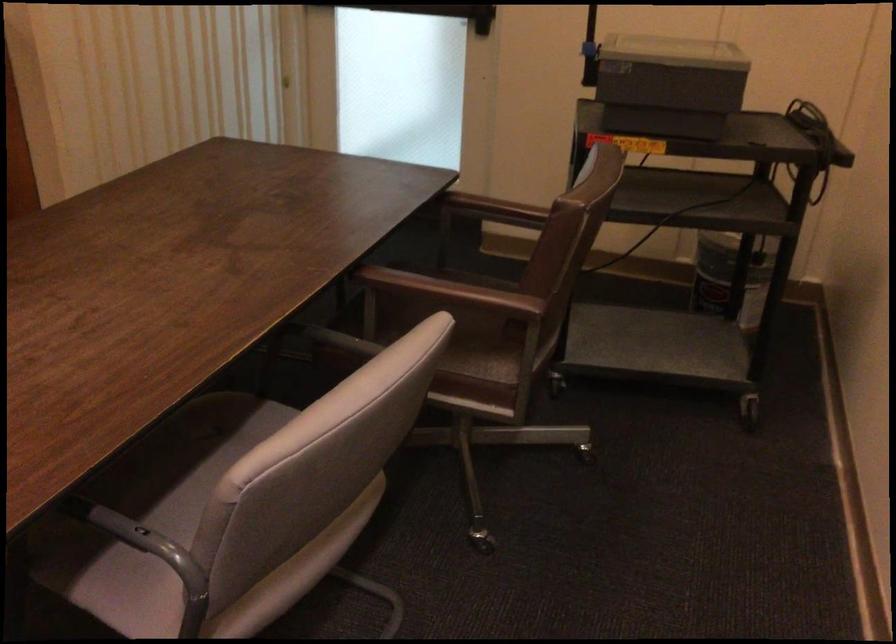
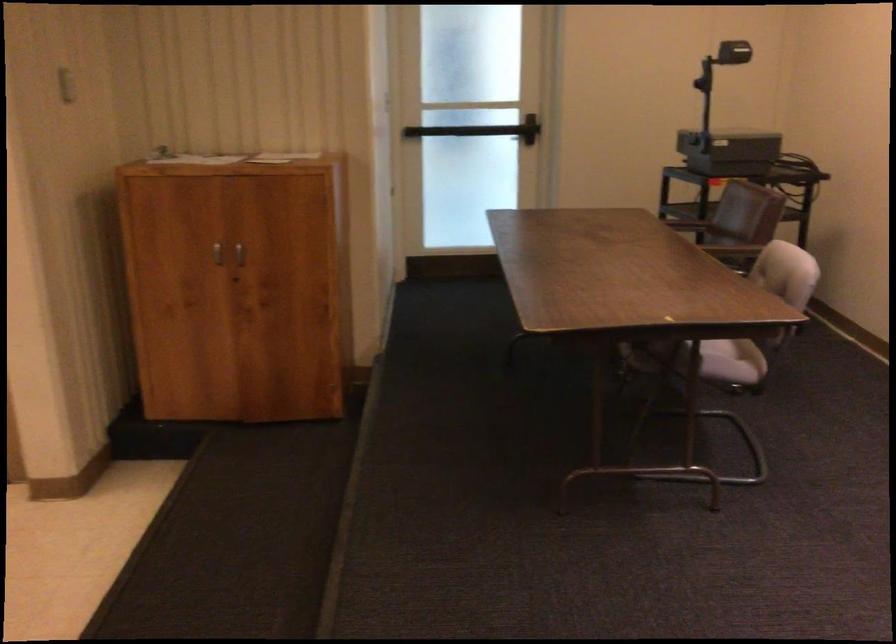
The point at (x=273, y=542) is marked in the first image. Where is the corresponding point in the second image?

(737, 348)